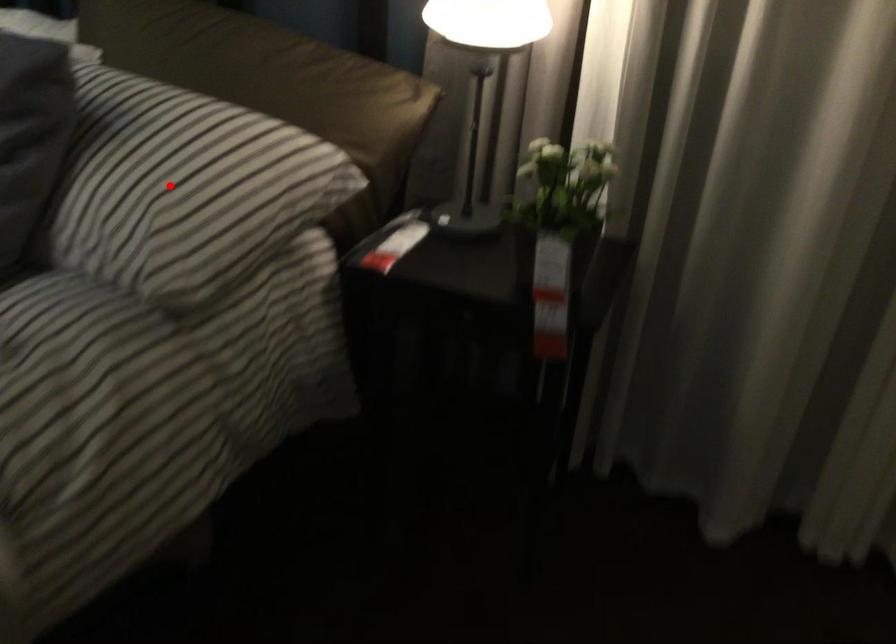
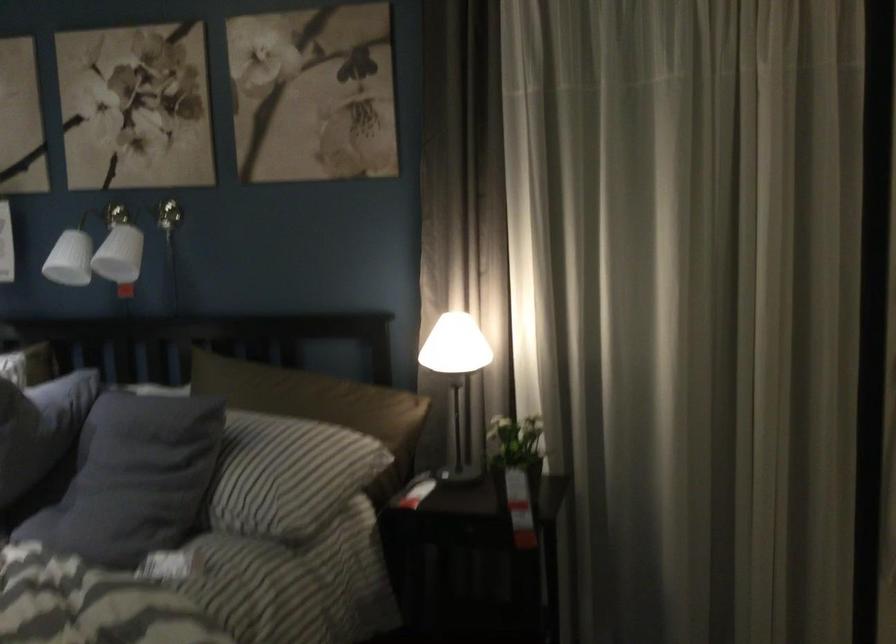
Question: I am providing you with two images of the same scene from different viewpoints. A red point is shown in image1. For the corresponding object point in image2, is it positioned nearer or farther from the camera?

Choices:
 (A) Nearer
 (B) Farther

Answer: (B)